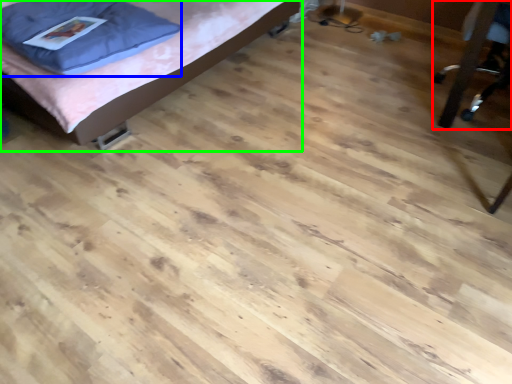
Question: Which object is positioned closest to furniture (highlighted by a red box)? Select from pillow (highlighted by a blue box) and bed (highlighted by a green box).

Choices:
 (A) pillow
 (B) bed

Answer: (B)